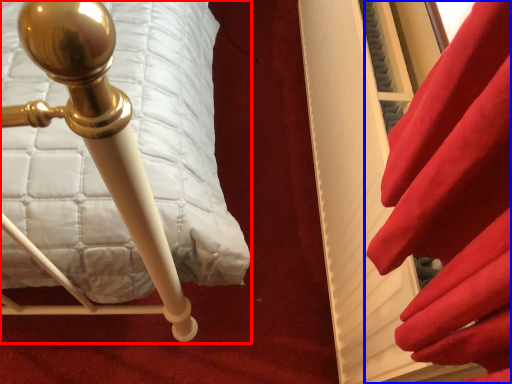
Question: Which point is closer to the camera, furniture (highlighted by a red box) or curtain (highlighted by a blue box)?

Choices:
 (A) furniture
 (B) curtain

Answer: (B)